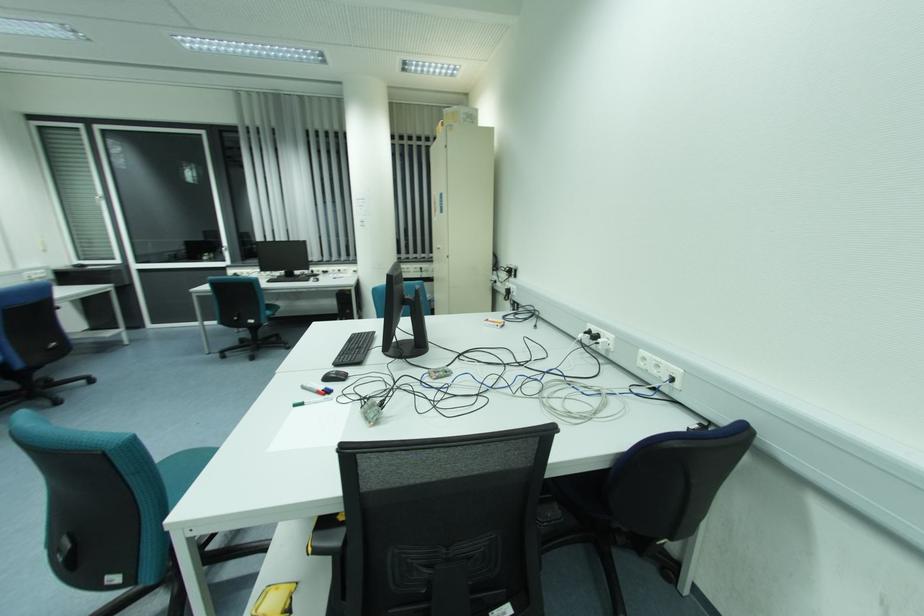
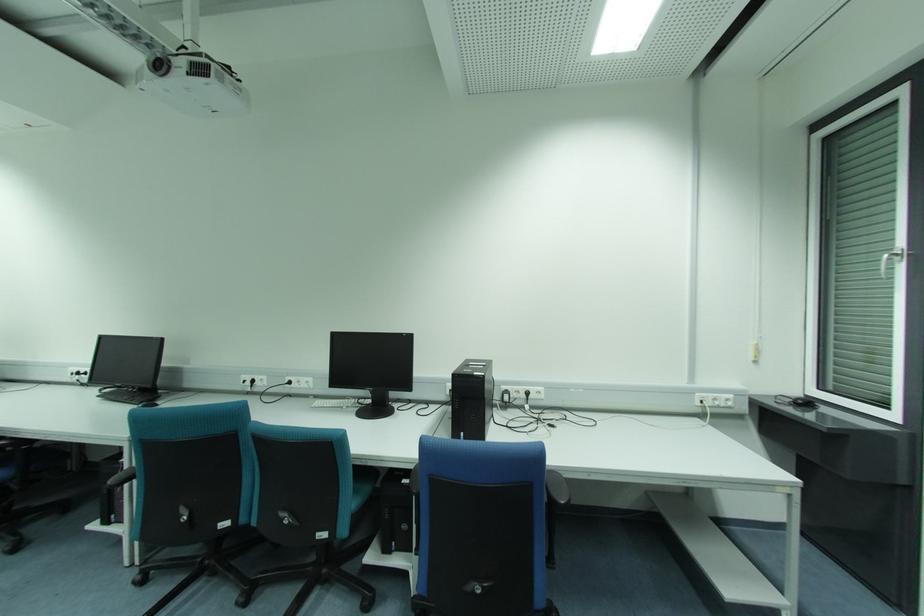
The point at (82, 265) is marked in the first image. Where is the corresponding point in the second image?

(808, 403)